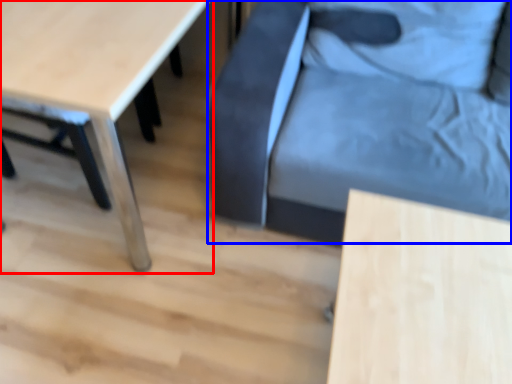
Question: Among these objects, which one is farthest to the camera, table (highlighted by a red box) or swivel chair (highlighted by a blue box)?

Choices:
 (A) table
 (B) swivel chair

Answer: (B)